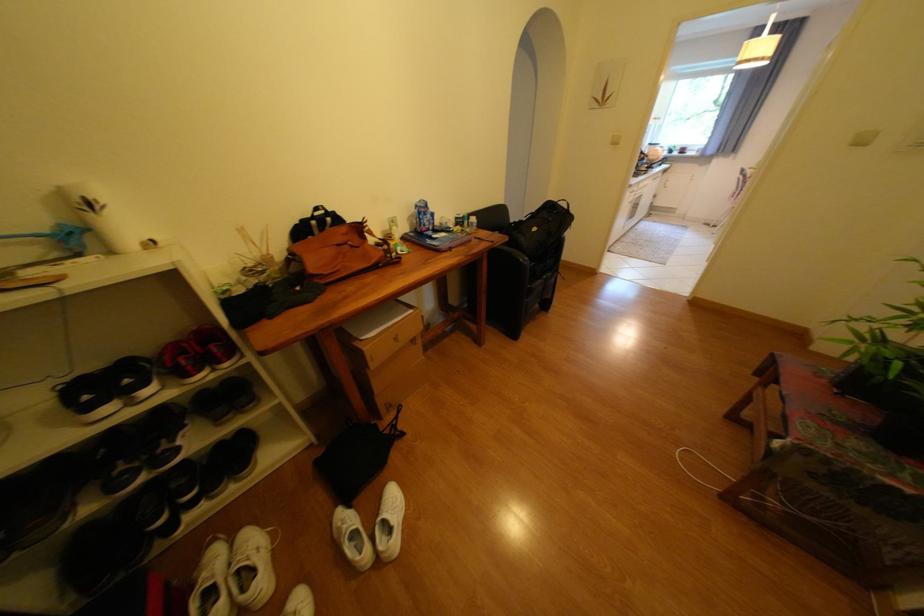
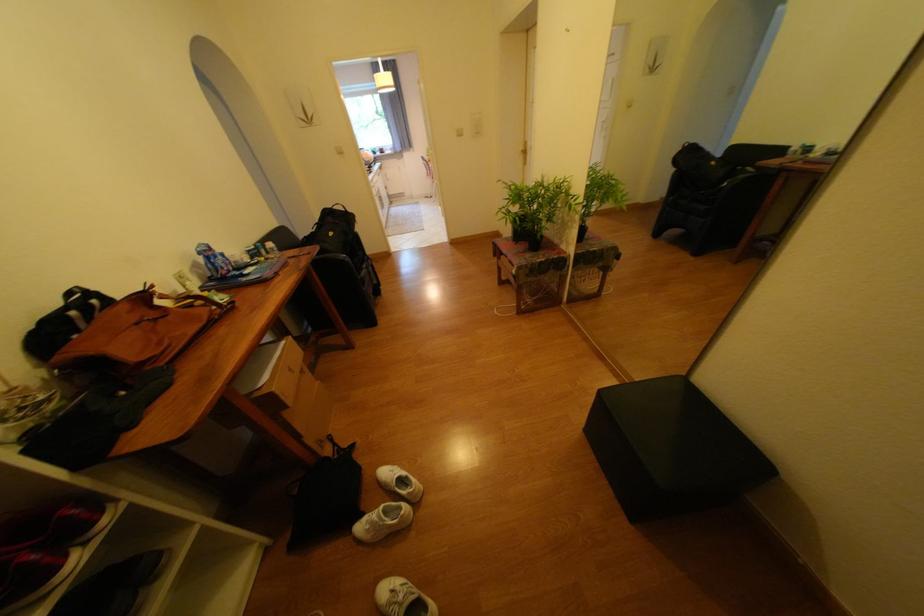
Question: How did the camera likely rotate?

Choices:
 (A) Left
 (B) Right
 (C) Up
 (D) Down

Answer: (B)